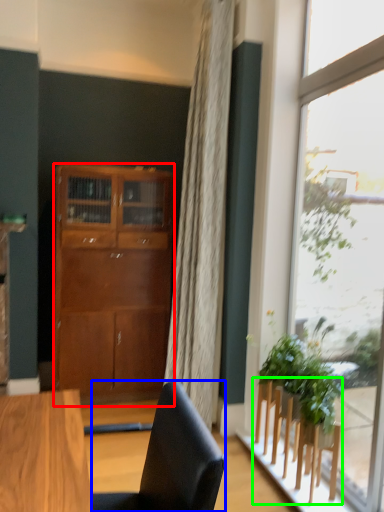
Question: Which is nearer to the cabinetry (highlighted by a red box)? chair (highlighted by a blue box) or furniture (highlighted by a green box).

Choices:
 (A) chair
 (B) furniture

Answer: (B)